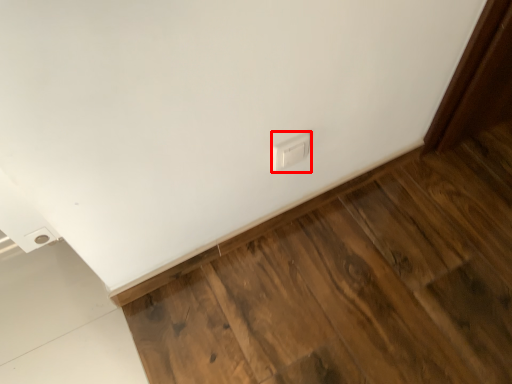
Question: Where is electric outlet (annotated by the red box) located in relation to hardwood in the image?

Choices:
 (A) left
 (B) right

Answer: (B)